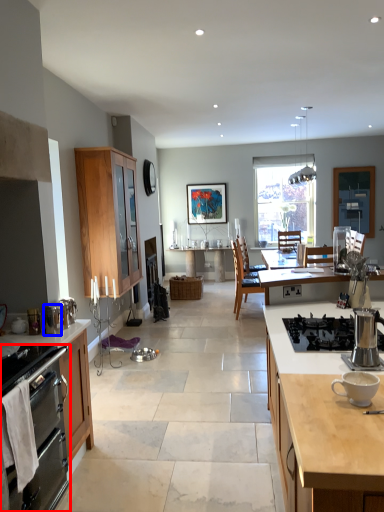
Question: Among these objects, which one is nearest to the camera, kitchen appliance (highlighted by a red box) or appliance (highlighted by a blue box)?

Choices:
 (A) kitchen appliance
 (B) appliance

Answer: (A)